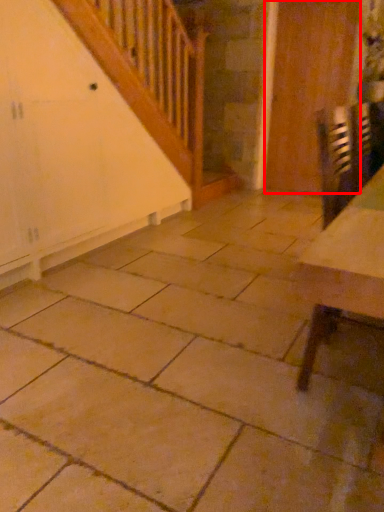
Question: From the image's perspective, considering the relative positions of door (annotated by the red box) and table in the image provided, where is door (annotated by the red box) located with respect to the staircase?

Choices:
 (A) above
 (B) below

Answer: (A)